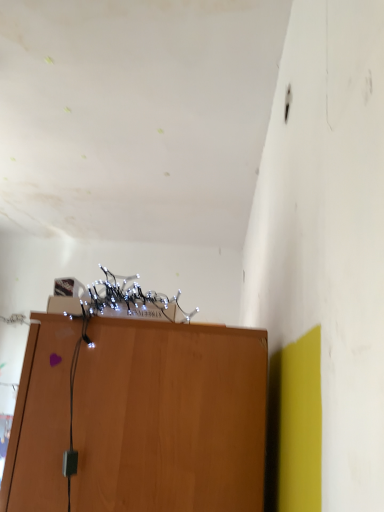
This screenshot has height=512, width=384. Describe the element at coordinates (169, 417) in the screenshot. I see `wooden cabinet at center` at that location.

At what (x,y) coordinates should I click in order to perform the action: click on wooden cabinet at center. Please return your answer as a coordinate pair (x, y). The width and height of the screenshot is (384, 512). Looking at the image, I should click on (169, 417).

Where is `wooden cabinet at center`? wooden cabinet at center is located at coordinates (169, 417).